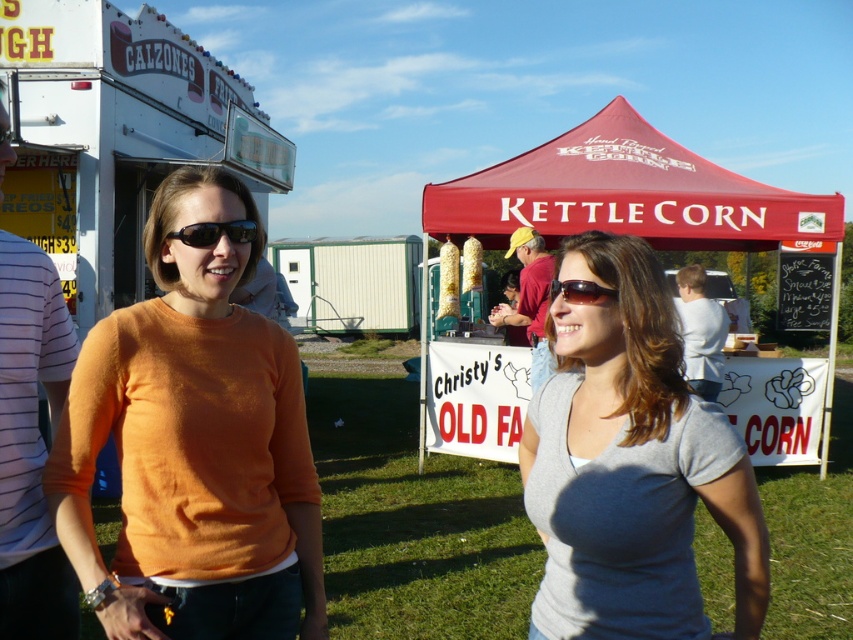
You are standing at the fair and want to buy kettle corn from the stand under the maroon fabric canopy at upper center. You are currently wearing the white striped shirt at left. If you walk straight towards the canopy, will you be able to reach it without moving sideways?

The maroon fabric canopy at upper center is 5.89 meters away from the white striped shirt at left. Since you are wearing the white striped shirt at left, you can walk straight towards the canopy and reach it without needing to move sideways as the distance is sufficient.

You are at the fair and want to buy kettle corn from the stand. You see the maroon fabric canopy at upper center and the white striped shirt at left. Which object is higher in the scene?

The maroon fabric canopy at upper center is higher in the scene because it is located above the white striped shirt at left.

You are a photographer taking a picture of the two women in the scene. You notice the orange sweater at left and the black plastic sunglasses at left. Which object is positioned more to the left side of the image?

The orange sweater at left is positioned more to the left side of the image than the black plastic sunglasses at left.